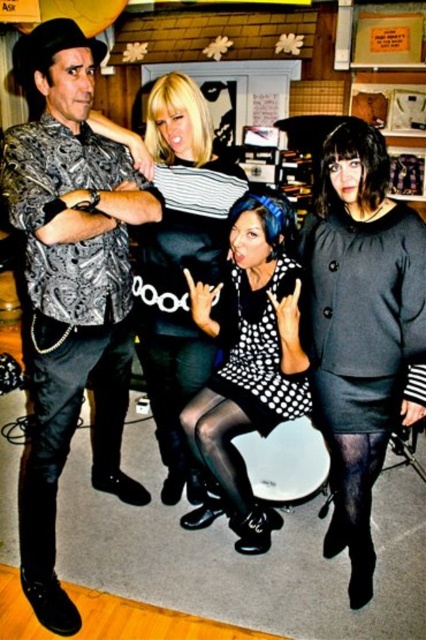
You are a photographer setting up a shoot in the music venue. You need to position a spotlight so it can illuminate both the matte black dress at center and the black matte dress at center equally. Considering their heights, which dress should you adjust the spotlight height for?

The matte black dress at center is not as tall as black matte dress at center, so you should adjust the spotlight height to focus more on the taller black matte dress at center to ensure both receive equal illumination.

You are a photographer setting up for a photoshoot in this music scene. You need to position a spotlight that can reach both the matte black shirt at left and the matte black dress at center. Considering their heights, which object should the spotlight be aimed higher to illuminate effectively?

The spotlight should be aimed higher to illuminate the matte black shirt at left since it is taller than the matte black dress at center.